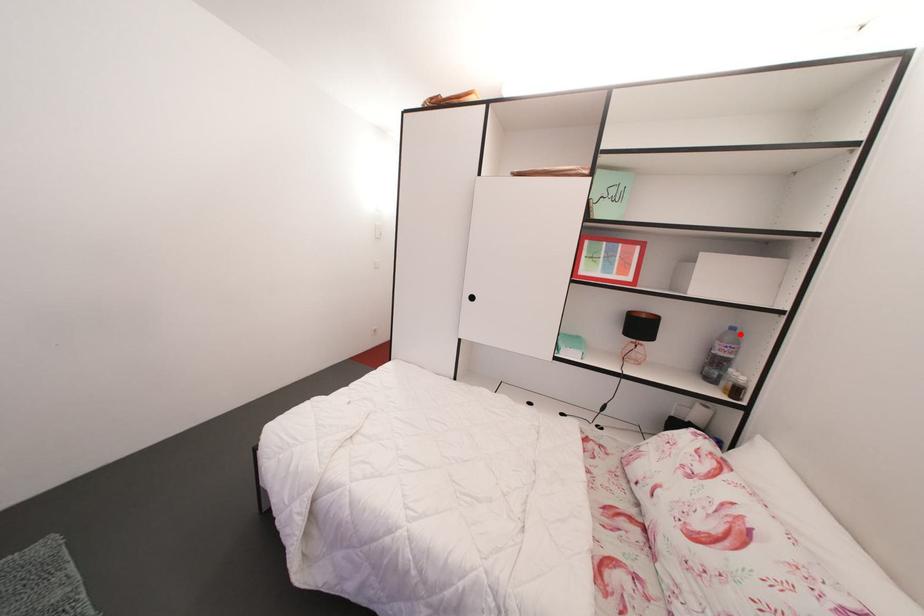
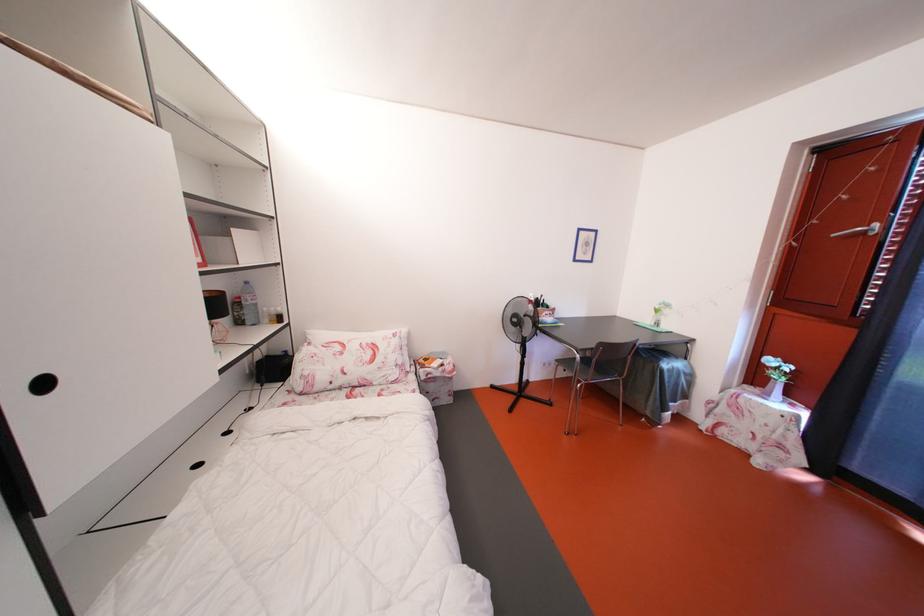
Find the pixel in the second image that matches the highlighted location in the first image.

(253, 288)